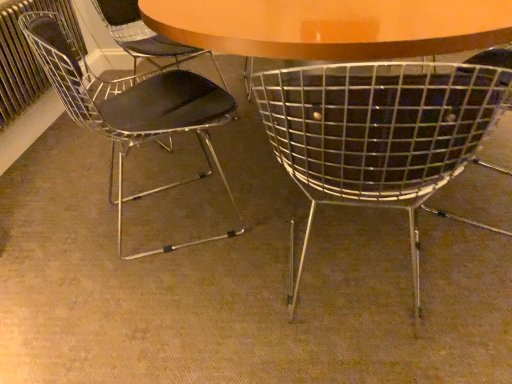
This screenshot has width=512, height=384. Identify the location of free spot to the right of metallic wire chair at left, the 1th chair from the left. pos(264,201).